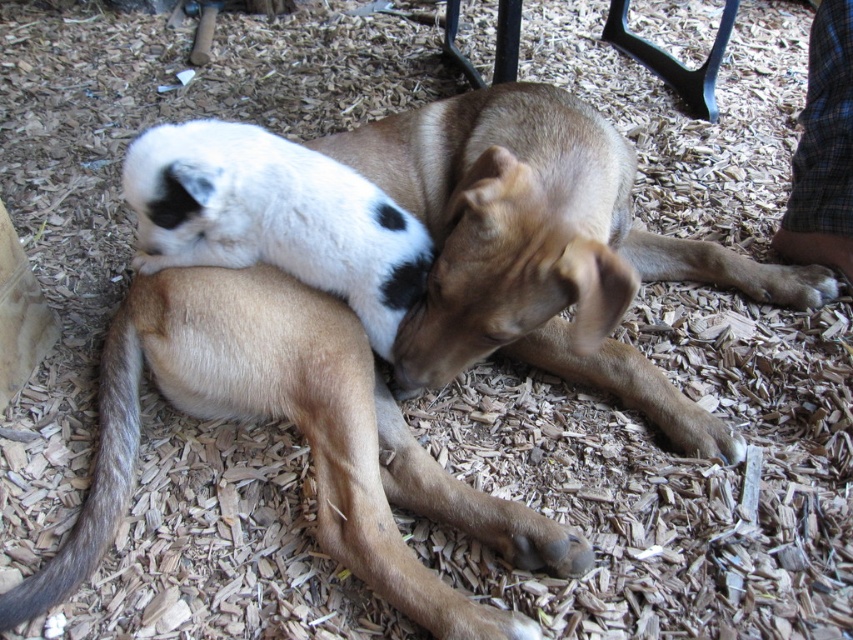
You are standing at a point 4.37 feet away from the point marked at coordinates point (42, 577) in the image. Can you see the two dogs lying on the bed of wood chips from your current position?

Yes, because the point marked at coordinates point (42, 577) is 4.37 feet away from you, so you can see the two dogs lying on the bed of wood chips from your current position.

Based on the photo, you are standing in front of the scene with two dogs on the wood chips. There are two points marked in the image. Which point is closer to you, point (175, 364) or point (701, 113)?

Point (175, 364) is closer to the viewer than point (701, 113).